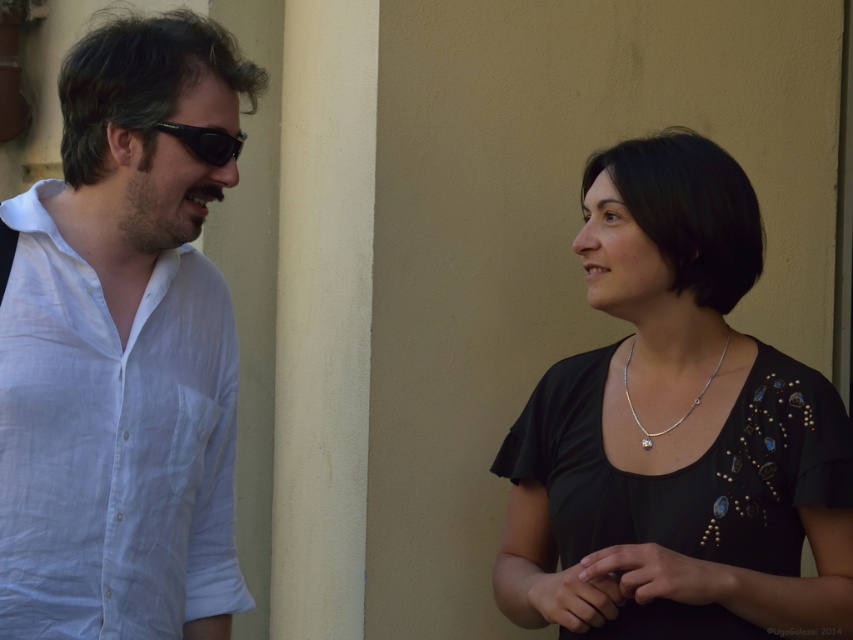
Looking at this image, who is more forward, (239, 134) or (648, 445)?

Point (239, 134)

Where is `black plastic sunglasses at left`? This screenshot has width=853, height=640. black plastic sunglasses at left is located at coordinates (206, 141).

Locate an element on the screen. The width and height of the screenshot is (853, 640). black plastic sunglasses at left is located at coordinates (206, 141).

The width and height of the screenshot is (853, 640). Describe the element at coordinates (123, 352) in the screenshot. I see `white linen shirt at left` at that location.

Does white linen shirt at left appear on the right side of silver/golden chain at center?

Incorrect, white linen shirt at left is not on the right side of silver/golden chain at center.

Does point (61, 524) come farther from viewer compared to point (640, 422)?

That is False.

I want to click on white linen shirt at left, so click(123, 352).

This screenshot has width=853, height=640. What do you see at coordinates (675, 429) in the screenshot? I see `black satin dress at right` at bounding box center [675, 429].

Can you confirm if black satin dress at right is shorter than silver/golden chain at center?

Incorrect, black satin dress at right's height does not fall short of silver/golden chain at center's.

Which is in front, point (677, 204) or point (643, 442)?

Point (677, 204) is more forward.

At what (x,y) coordinates should I click in order to perform the action: click on black satin dress at right. Please return your answer as a coordinate pair (x, y). This screenshot has width=853, height=640. Looking at the image, I should click on (675, 429).